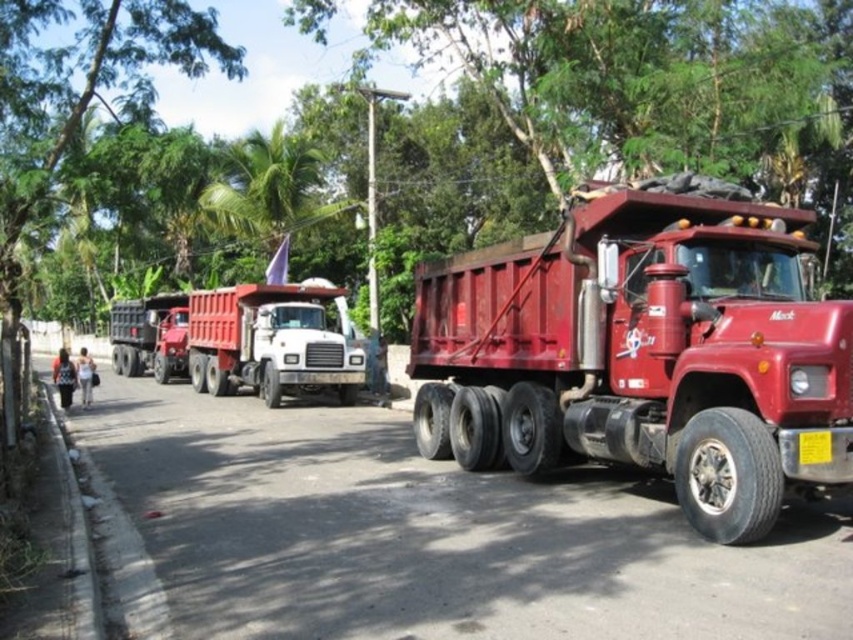
Question: Does shiny red trailer truck at center appear under metallic red dump truck at left?

Choices:
 (A) no
 (B) yes

Answer: (B)

Question: Among these objects, which one is nearest to the camera?

Choices:
 (A) green leafy tree at upper center
 (B) matte red dump truck at center

Answer: (B)

Question: Considering the relative positions of shiny red trailer truck at center and metallic red dump truck at left in the image provided, where is shiny red trailer truck at center located with respect to metallic red dump truck at left?

Choices:
 (A) below
 (B) above

Answer: (A)

Question: Which object is farther from the camera taking this photo?

Choices:
 (A) matte red dump truck at center
 (B) metallic red dump truck at left

Answer: (B)

Question: Which object appears farthest from the camera in this image?

Choices:
 (A) shiny red trailer truck at center
 (B) matte red dump truck at center
 (C) metallic red dump truck at left
 (D) green leafy tree at upper center

Answer: (C)

Question: Does matte red dump truck at center appear on the left side of green leafy tree at upper center?

Choices:
 (A) yes
 (B) no

Answer: (B)